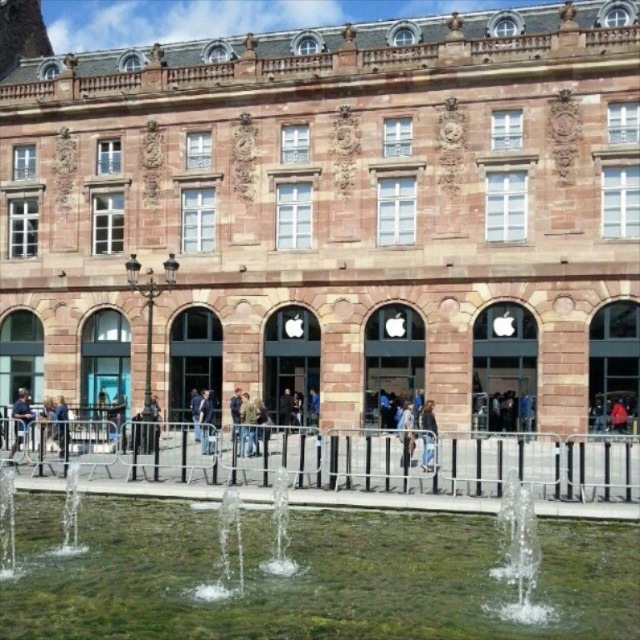
You are a photographer trying to capture a person wearing both a light brown leather jacket at center and blue denim jeans at center. Since you can only focus on one clothing item at a time, which one should you focus on to ensure the other is visible in the frame?

The light brown leather jacket at center is positioned over blue denim jeans at center, so focusing on the jacket will still allow the jeans to be visible beneath it.

You are standing in front of the historic building and see the point at coordinates (307, 577). What can you observe at that specific location?

The point at coordinates (307, 577) indicates clear water at center.

You are a tourist standing in front of the historic building and see the clear water at center and the green stone fountain at lower center. Which object is located higher up in the image?

The green stone fountain at lower center is higher up in the image because the clear water at center is below it.